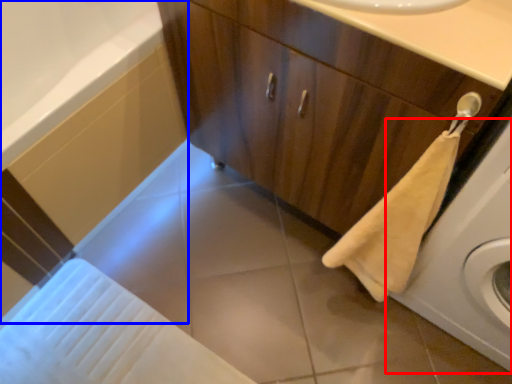
Question: Which object appears closest to the camera in this image, washing machine (highlighted by a red box) or bath (highlighted by a blue box)?

Choices:
 (A) washing machine
 (B) bath

Answer: (A)